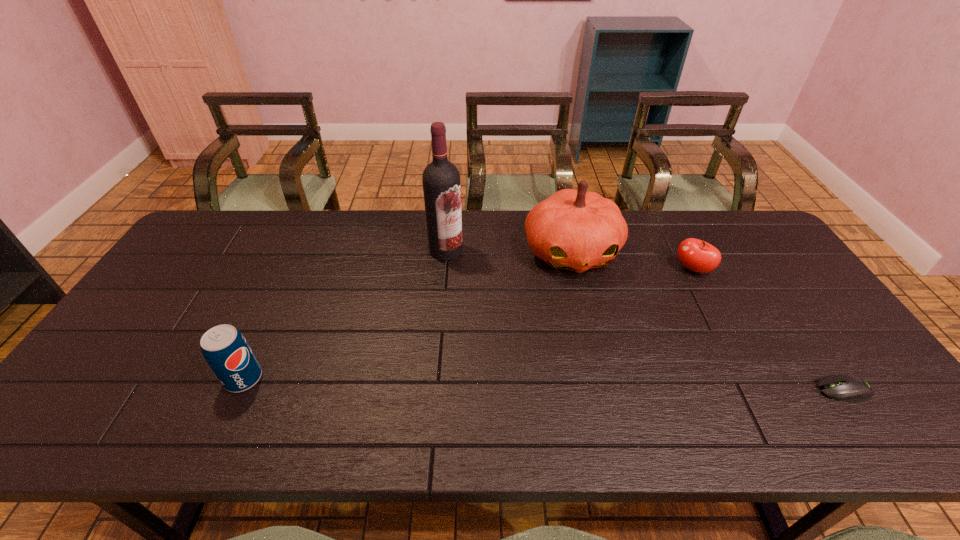
Where is `vacant space at the near edge`? This screenshot has width=960, height=540. vacant space at the near edge is located at coordinates (324, 401).

Where is `free region at the left edge of the desktop`? The height and width of the screenshot is (540, 960). free region at the left edge of the desktop is located at coordinates (210, 255).

Find the location of a particular element. free region at the right edge of the desktop is located at coordinates [x=816, y=363].

Locate an element on the screen. free space at the far left corner is located at coordinates (211, 233).

Find the location of a particular element. The height and width of the screenshot is (540, 960). blank space at the far right corner is located at coordinates (756, 231).

This screenshot has width=960, height=540. What are the coordinates of `empty space between the fourth shortest object and the pop` in the screenshot? It's located at (408, 315).

Locate an element on the screen. vacant region between the leftmost object and the second shortest object is located at coordinates (468, 324).

I want to click on empty location between the computer mouse and the second shortest object, so click(768, 330).

Locate an element on the screen. This screenshot has width=960, height=540. vacant area between the apple and the third tallest object is located at coordinates (468, 324).

Where is `unoccupied position between the computer mouse and the apple`? unoccupied position between the computer mouse and the apple is located at coordinates (768, 330).